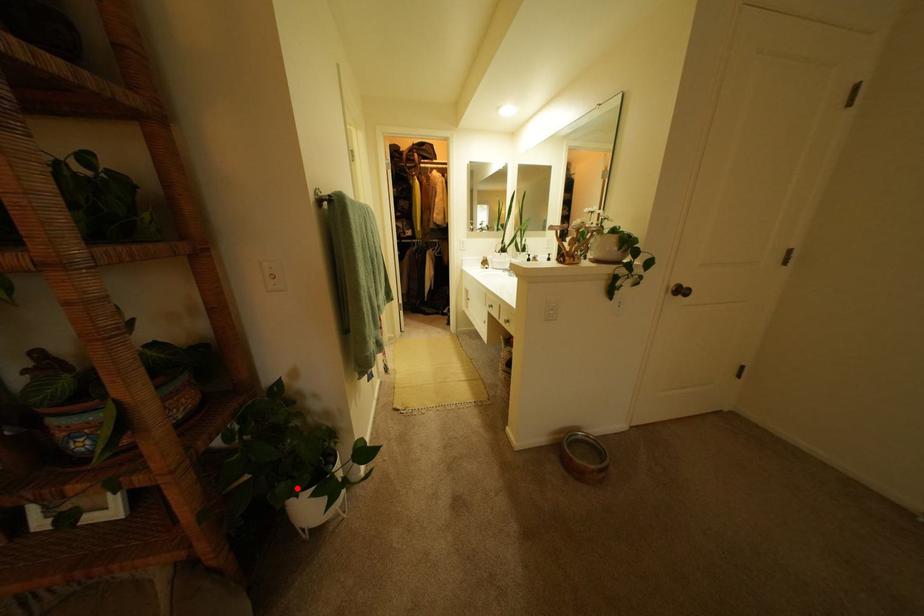
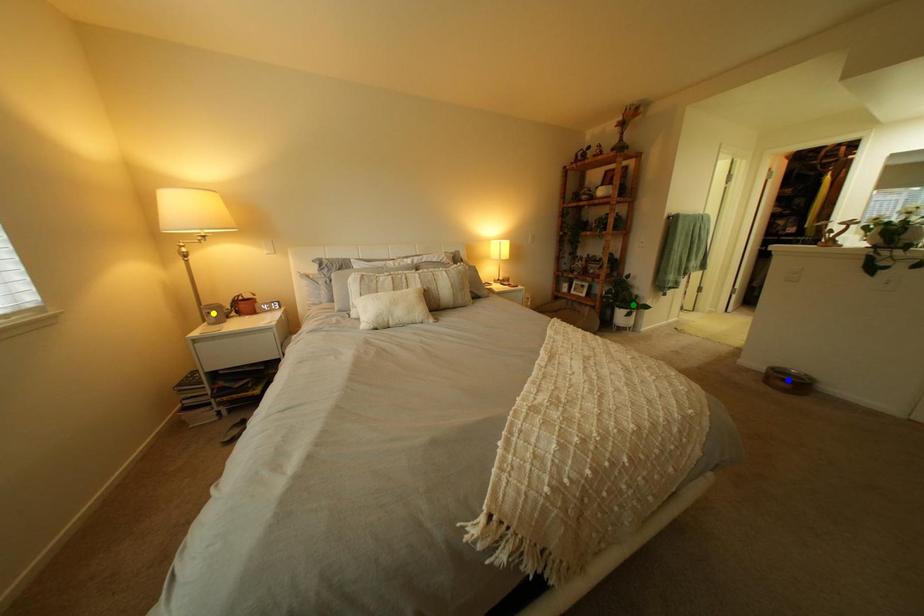
Question: I am providing you with two images of the same scene from different viewpoints. A red point is marked on the first image. You are given multiple points on the second image. Which point in image 2 is actually the same real-world point as the red point in image 1?

Choices:
 (A) yellow point
 (B) green point
 (C) blue point

Answer: (B)